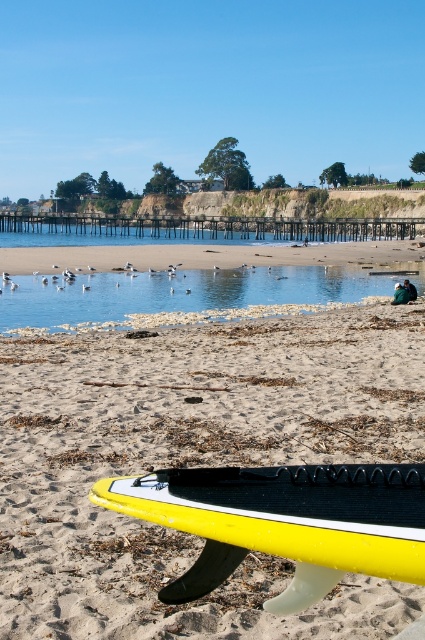
Question: Which point appears closest to the camera in this image?

Choices:
 (A) (367, 538)
 (B) (387, 285)

Answer: (A)

Question: In this image, where is yellow foam surfboard at lower center located relative to clear water at center?

Choices:
 (A) right
 (B) left

Answer: (A)

Question: Which point appears closest to the camera in this image?

Choices:
 (A) (209, 273)
 (B) (337, 508)
 (C) (3, 595)

Answer: (B)

Question: Can you confirm if yellow foam surfboard at lower center is positioned to the left of clear water at center?

Choices:
 (A) yes
 (B) no

Answer: (B)

Question: Can you confirm if yellow matte surfboard at lower center is thinner than clear water at center?

Choices:
 (A) yes
 (B) no

Answer: (A)

Question: Which object is the farthest from the yellow matte surfboard at lower center?

Choices:
 (A) clear water at center
 (B) yellow foam surfboard at lower center

Answer: (A)